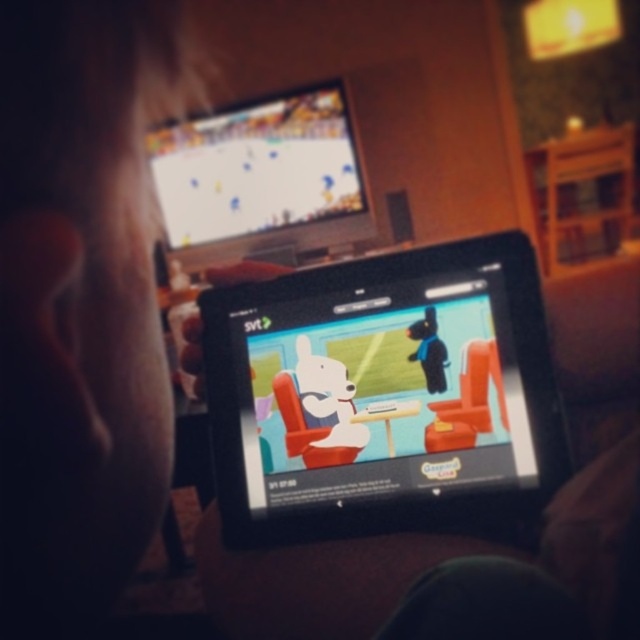
You are holding a 16.5 inch long ruler. If you want to measure the distance between your eyes and the black glossy tablet at center, can you use the ruler to reach that distance?

The black glossy tablet at center is 16.49 inches away from the viewer. Since the ruler is 16.5 inches long, it is slightly longer than the distance. Therefore, you can use the ruler to measure the distance between your eyes and the black glossy tablet at center.

You are an interior designer planning to hang a new picture above the black glossy tablet at center. Based on the scene, where should the picture be placed relative to the matte plastic tv at upper center?

The black glossy tablet at center is located below the matte plastic tv at upper center, so the picture should be placed above the matte plastic tv at upper center to maintain alignment.

You are a person who wants to place a 2.5 feet wide decorative shelf between the black glossy tablet at center and the matte plastic tv at upper center. Can you fit it there?

The distance between the black glossy tablet at center and the matte plastic tv at upper center is 6.64 feet. Since the shelf is 2.5 feet wide, it can fit as long as the shelf is placed within that space.